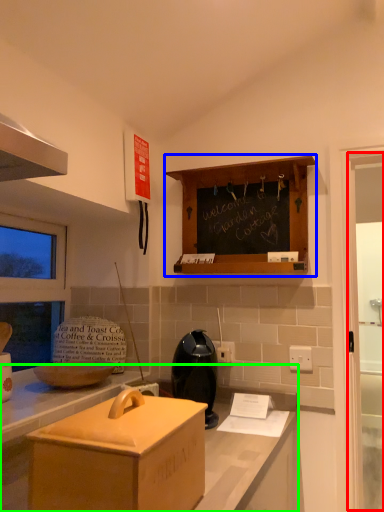
Question: Considering the real-world distances, which object is closest to glass door (highlighted by a red box)? cabinetry (highlighted by a blue box) or countertop (highlighted by a green box).

Choices:
 (A) cabinetry
 (B) countertop

Answer: (A)